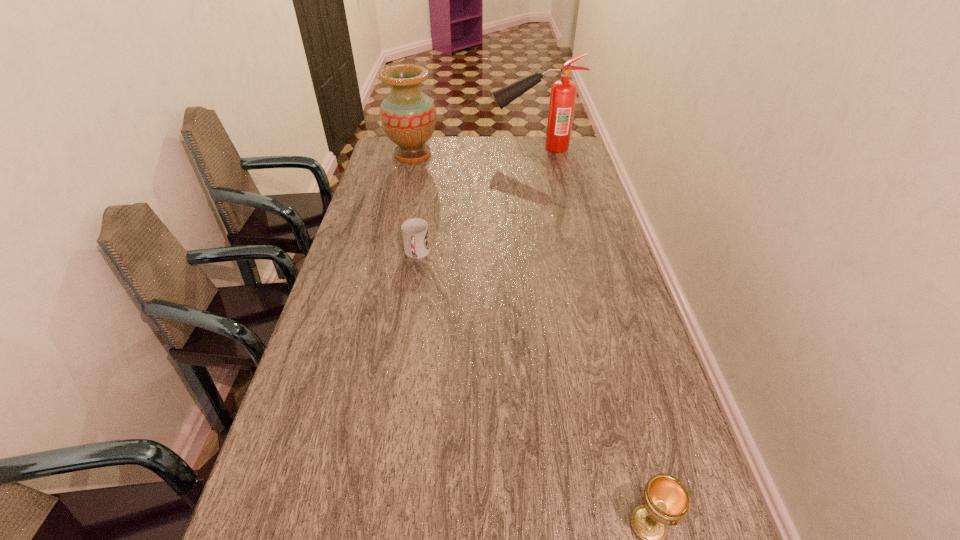
At what (x,y) coordinates should I click in order to perform the action: click on vase that is at the far edge. Please return your answer as a coordinate pair (x, y). Looking at the image, I should click on (408, 116).

This screenshot has width=960, height=540. I want to click on object situated at the left edge, so click(408, 116).

Where is `object at the right edge`? object at the right edge is located at coordinates (563, 92).

Locate an element on the screen. object that is at the far left corner is located at coordinates (408, 116).

Where is `object present at the far right corner`? This screenshot has width=960, height=540. object present at the far right corner is located at coordinates (563, 92).

You are a GUI agent. You are given a task and a screenshot of the screen. Output one action in this format:
    pyautogui.click(x=<x>, y=<y>)
    Task: Click on the vacant area at the far edge
    
    Given the screenshot: What is the action you would take?
    pyautogui.click(x=436, y=155)

Find the location of `vacant area at the left edge of the desktop`. vacant area at the left edge of the desktop is located at coordinates (324, 302).

Locate an element on the screen. vacant space at the right edge is located at coordinates (698, 502).

In the image, there is a desktop. At what (x,y) coordinates should I click in order to perform the action: click on vacant space at the far left corner. Please return your answer as a coordinate pair (x, y). Looking at the image, I should click on (387, 162).

Image resolution: width=960 pixels, height=540 pixels. Find the location of `vacant area that lies between the fire extinguisher and the vase`. vacant area that lies between the fire extinguisher and the vase is located at coordinates [473, 151].